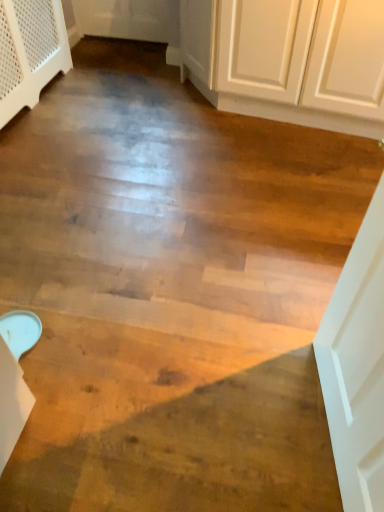
Where is `free space to the back side of white matte door at right`? The image size is (384, 512). free space to the back side of white matte door at right is located at coordinates (280, 320).